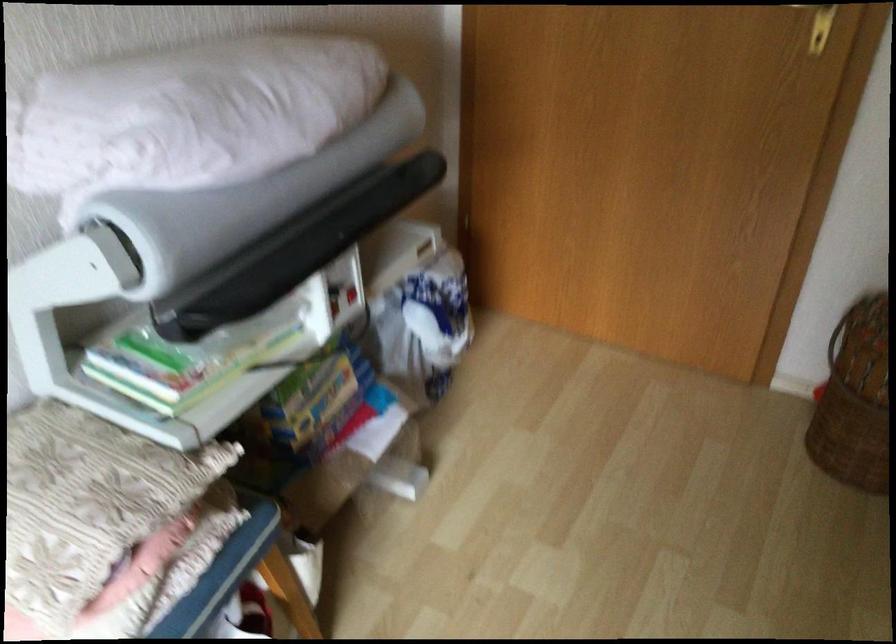
This screenshot has width=896, height=644. Find the location of `red power switch`. red power switch is located at coordinates (821, 28).